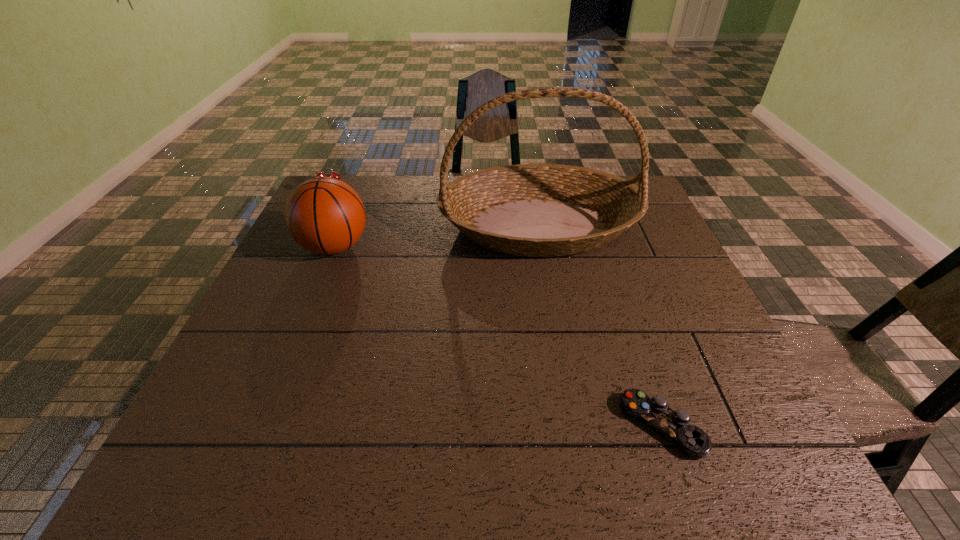
I want to click on alarm clock at the far edge, so click(336, 175).

Image resolution: width=960 pixels, height=540 pixels. In order to click on object positioned at the near edge in this screenshot , I will do `click(674, 425)`.

Where is `basketball that is positioned at the left edge`? The image size is (960, 540). basketball that is positioned at the left edge is located at coordinates (324, 215).

Where is `alarm clock located at the left edge`? This screenshot has height=540, width=960. alarm clock located at the left edge is located at coordinates (336, 175).

Locate an element on the screen. This screenshot has width=960, height=540. basket positioned at the right edge is located at coordinates (535, 210).

Where is `control that is at the right edge`? control that is at the right edge is located at coordinates (674, 425).

This screenshot has height=540, width=960. Find the location of `object situated at the far left corner`. object situated at the far left corner is located at coordinates (336, 175).

Locate an element on the screen. object situated at the far right corner is located at coordinates (535, 210).

Locate an element on the screen. This screenshot has width=960, height=540. object located in the near right corner section of the desktop is located at coordinates (674, 425).

Image resolution: width=960 pixels, height=540 pixels. In order to click on vacant space at the far edge of the desktop in this screenshot , I will do `click(384, 199)`.